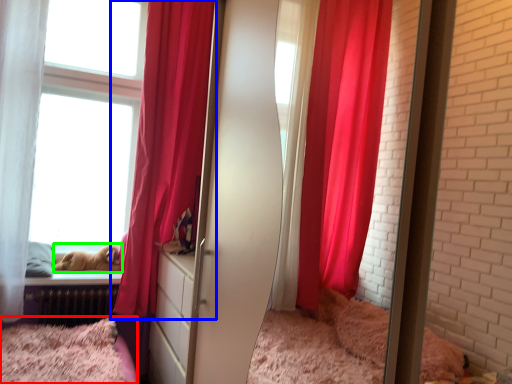
Question: Which is farther away from bed (highlighted by a red box)? curtain (highlighted by a blue box) or animal (highlighted by a green box)?

Choices:
 (A) curtain
 (B) animal

Answer: (A)